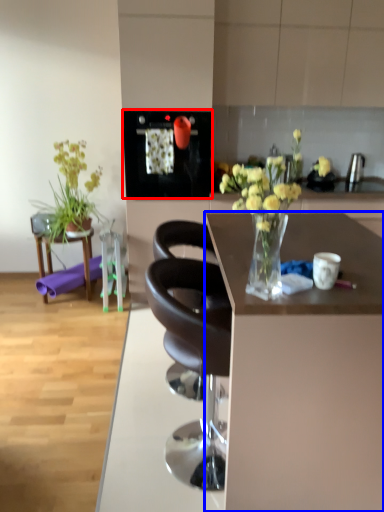
Question: Which point is closer to the camera, appliance (highlighted by a red box) or desk (highlighted by a blue box)?

Choices:
 (A) appliance
 (B) desk

Answer: (B)